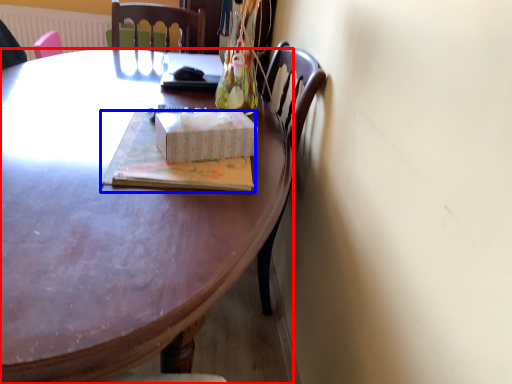
Question: Which of the following is the closest to the observer, desk (highlighted by a red box) or book (highlighted by a blue box)?

Choices:
 (A) desk
 (B) book

Answer: (A)